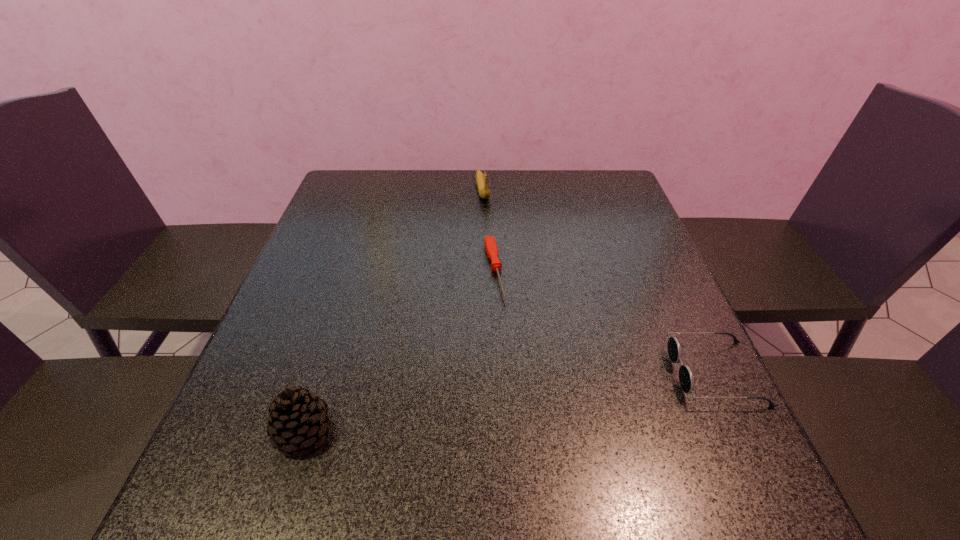
Where is `free space on the desktop that is between the pinecone and the third tallest object and is positioned at the stem of the banana`? This screenshot has width=960, height=540. free space on the desktop that is between the pinecone and the third tallest object and is positioned at the stem of the banana is located at coordinates (540, 398).

Locate an element on the screen. Image resolution: width=960 pixels, height=540 pixels. free space on the desktop that is between the leftmost object and the second shortest object and is positioned at the tip of the shortest object is located at coordinates (528, 400).